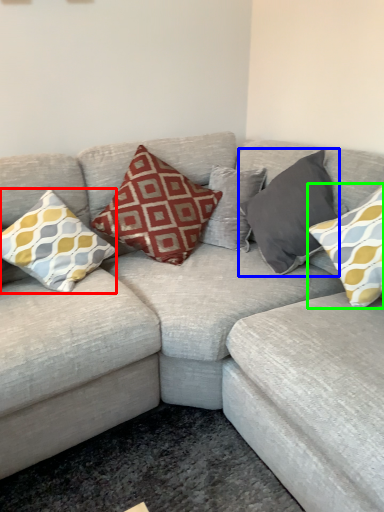
Question: Estimate the real-world distances between objects in this image. Which object is farther from pillow (highlighted by a red box), pillow (highlighted by a blue box) or pillow (highlighted by a green box)?

Choices:
 (A) pillow
 (B) pillow

Answer: (B)